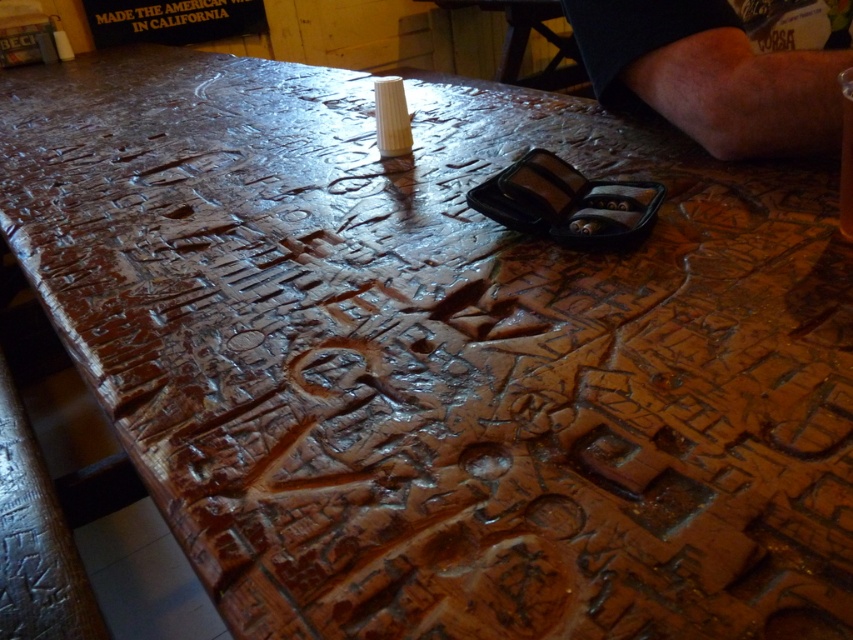
You are a server in a restaurant and you see the black plastic text at upper center and the translucent glass beer at upper center on the table. Which item is closer to the left edge of the table?

The black plastic text at upper center is to the left of the translucent glass beer at upper center, so it is closer to the left edge of the table.

You are an observer looking at the table. You see the dark skin at upper right and the black plastic text at upper center. Which one is shorter in height?

The dark skin at upper right has a lesser height compared to the black plastic text at upper center, so the dark skin at upper right is shorter.